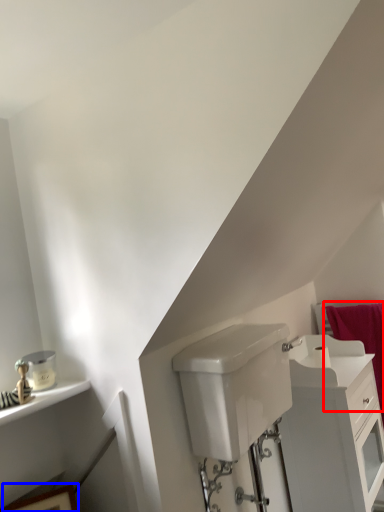
Question: Among these objects, which one is farthest to the camera, bath towel (highlighted by a red box) or picture frame (highlighted by a blue box)?

Choices:
 (A) bath towel
 (B) picture frame

Answer: (A)